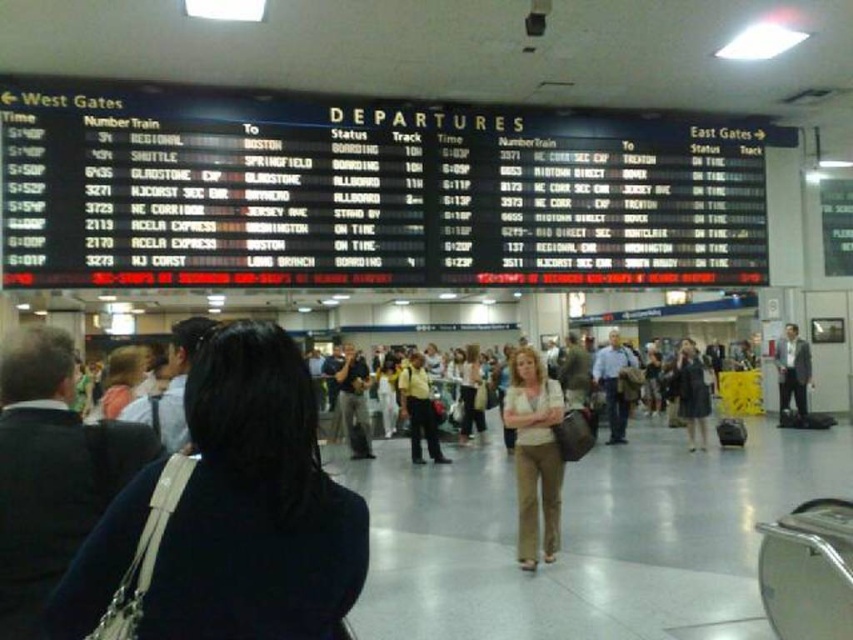
Question: Among these points, which one is farthest from the camera?

Choices:
 (A) (422, 429)
 (B) (689, 445)
 (C) (254, 486)

Answer: (A)

Question: Does yellow fabric shirt at center have a lesser width compared to dark gray fabric dress at right?

Choices:
 (A) yes
 (B) no

Answer: (B)

Question: Considering the real-world distances, which object is farthest from the dark gray shirt at center?

Choices:
 (A) beige fabric pants at center
 (B) black fabric coat at center
 (C) dark gray fabric dress at right
 (D) yellow fabric shirt at center

Answer: (B)

Question: Considering the real-world distances, which object is closest to the light beige pants at center?

Choices:
 (A) dark gray shirt at center
 (B) black fabric coat at center
 (C) dark gray fabric dress at right
 (D) beige fabric pants at center

Answer: (A)

Question: Does black fabric coat at center lie behind yellow fabric shirt at center?

Choices:
 (A) yes
 (B) no

Answer: (B)

Question: Is the position of beige fabric pants at center less distant than that of dark gray shirt at center?

Choices:
 (A) no
 (B) yes

Answer: (B)